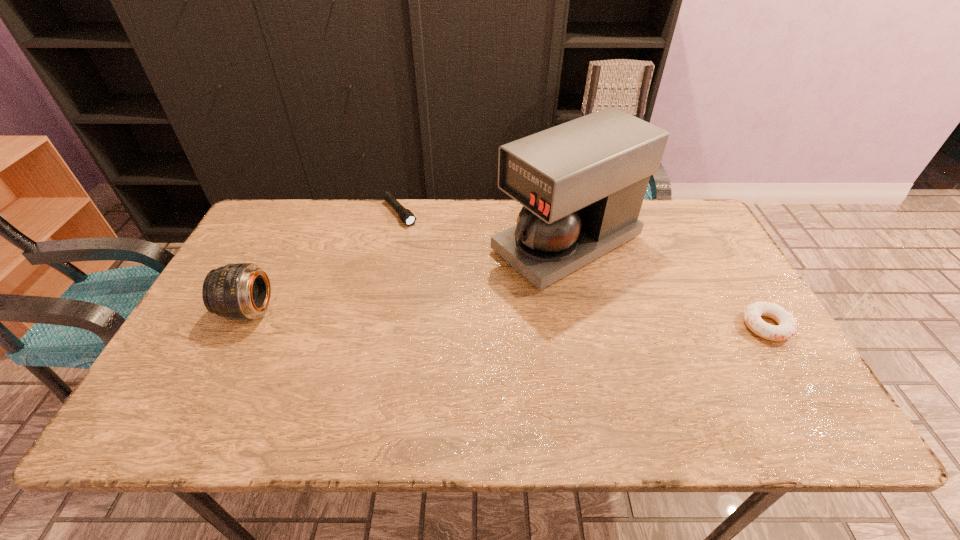
Image resolution: width=960 pixels, height=540 pixels. In order to click on the leftmost object in this screenshot , I will do `click(242, 291)`.

At what (x,y) coordinates should I click in order to perform the action: click on telephoto lens. Please return your answer as a coordinate pair (x, y). Image resolution: width=960 pixels, height=540 pixels. Looking at the image, I should click on (242, 291).

At what (x,y) coordinates should I click in order to perform the action: click on the rightmost object. Please return your answer as a coordinate pair (x, y). Looking at the image, I should click on (787, 326).

Locate an element on the screen. The height and width of the screenshot is (540, 960). the third object from left to right is located at coordinates (582, 183).

This screenshot has height=540, width=960. In order to click on the tallest object in this screenshot , I will do `click(582, 183)`.

This screenshot has width=960, height=540. I want to click on flashlight, so click(x=405, y=215).

I want to click on free space located 0.060m at the front element of the third shortest object, so click(204, 310).

Where is `vacant region located 0.190m on the back of the doughnut`? vacant region located 0.190m on the back of the doughnut is located at coordinates [727, 260].

You are a GUI agent. You are given a task and a screenshot of the screen. Output one action in this format:
    pyautogui.click(x=<x>, y=<y>)
    Task: Click on the vacant space located on the carafe side of the tallest object
    This screenshot has height=540, width=960.
    Given the screenshot: What is the action you would take?
    pyautogui.click(x=492, y=279)

Image resolution: width=960 pixels, height=540 pixels. I want to click on vacant space located on the carafe side of the tallest object, so click(x=432, y=310).